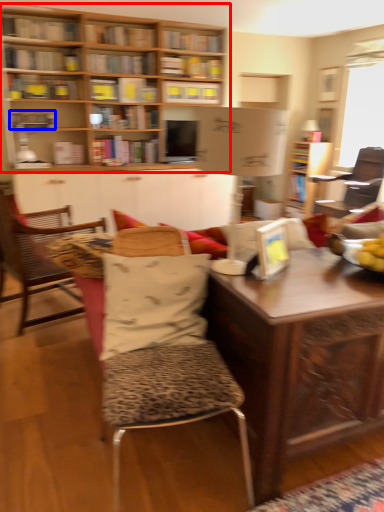
Question: Which object appears closest to the camera in this image, bookcase (highlighted by a red box) or book (highlighted by a blue box)?

Choices:
 (A) bookcase
 (B) book

Answer: (A)